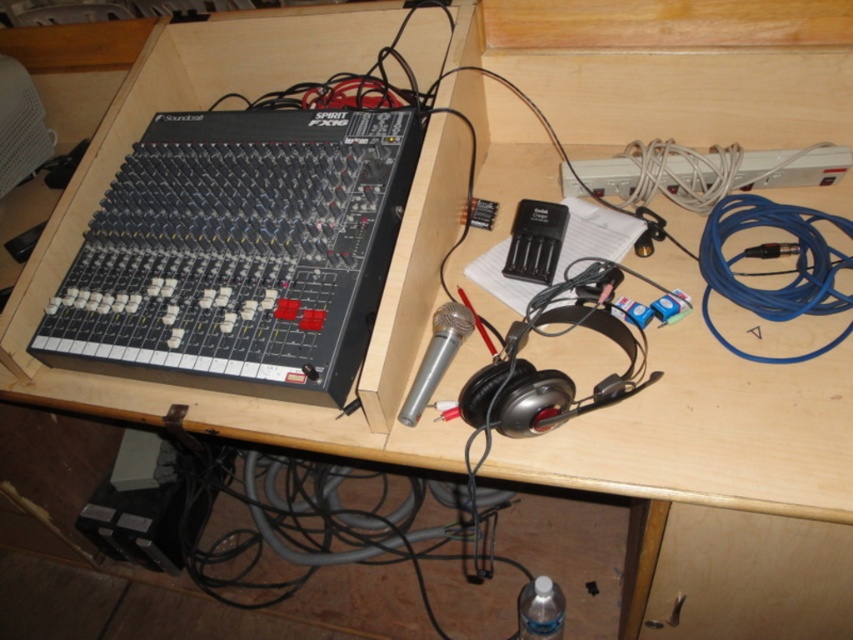
You are organizing a music studio and need to place a new equipment box at point (738,573). Is there space available at this point?

The point (738,573) is currently occupied by the wooden drawer at lower right, so there is no space available at this point.

You are setting up an audio system on the desk and need to connect the blue cable at right to a device. The wooden drawer at lower right is in the way. Can you move the drawer to access the cable?

The wooden drawer at lower right is taller than blue cable at right, so moving the drawer might be necessary to access the cable since the drawer is taller and could be blocking the cable.

You are standing in front of the desk with the Soundcraft Spirit FX16 mixing console. There are two points marked on the desk surface at coordinates point (641,625) and point (759,358). If you want to place a small object on the desk, which point is closer to you?

Point (641,625) is further to the camera than point (759,358), so the point closer to you is point (759,358).